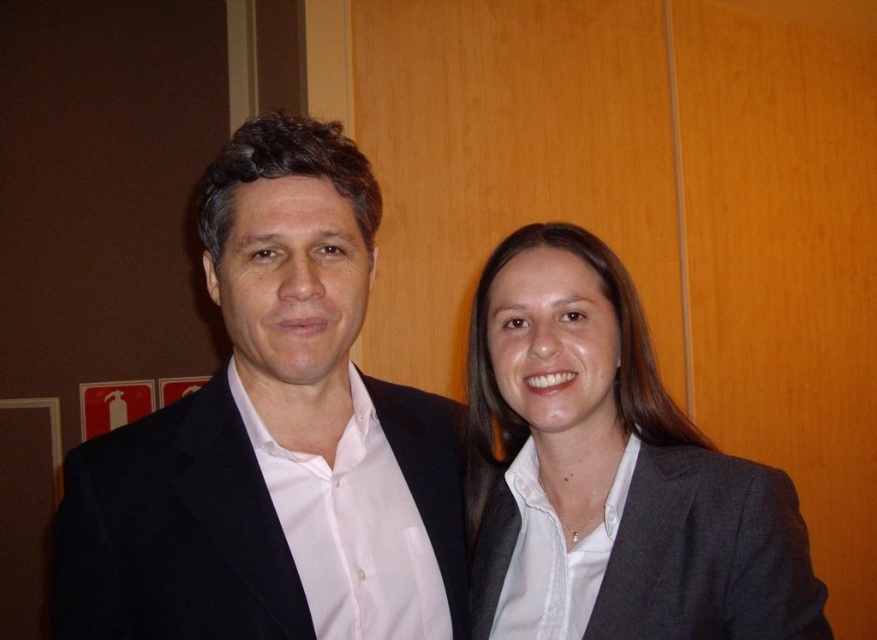
Question: Which point is farther to the camera?

Choices:
 (A) gray fabric business suit at center
 (B) matte gray blazer at right

Answer: (B)

Question: Is black matte suit at center behind matte gray blazer at right?

Choices:
 (A) no
 (B) yes

Answer: (A)

Question: Among these objects, which one is farthest from the camera?

Choices:
 (A) gray fabric business suit at center
 (B) black matte suit at center
 (C) matte gray blazer at right

Answer: (C)

Question: Which point is farther from the camera taking this photo?

Choices:
 (A) (597, 250)
 (B) (203, 516)
 (C) (504, 499)

Answer: (C)

Question: Is matte gray blazer at right bigger than gray fabric business suit at center?

Choices:
 (A) no
 (B) yes

Answer: (B)

Question: Does matte gray blazer at right appear on the left side of gray fabric business suit at center?

Choices:
 (A) yes
 (B) no

Answer: (A)